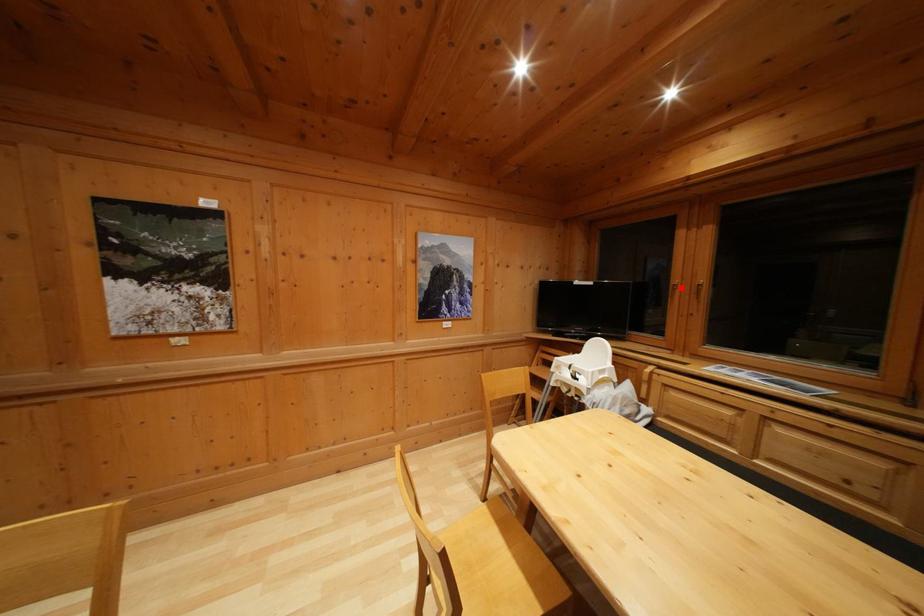
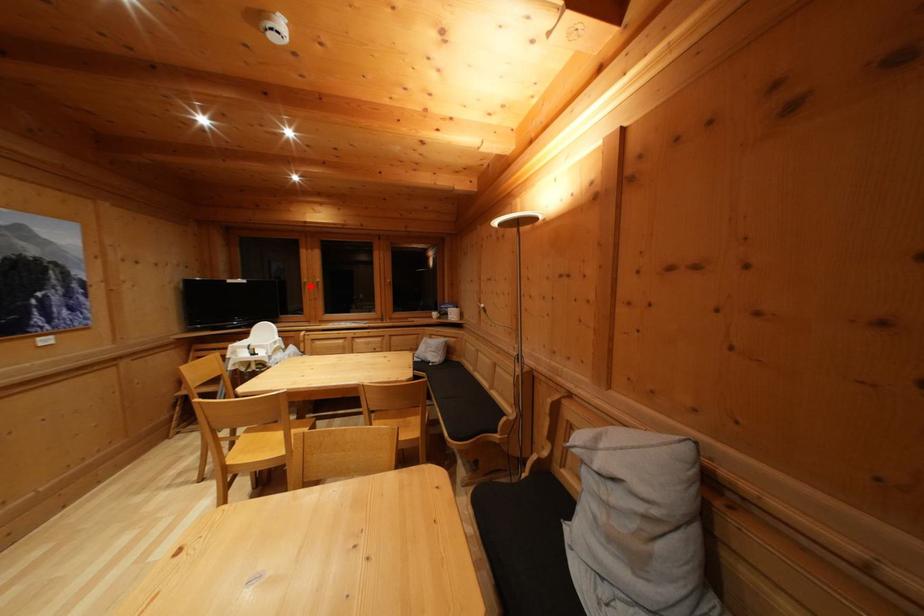
I am providing you with two images of the same scene from different viewpoints. A red point is marked on the first image and another point is marked on the second image. Is the red point in image1 aligned with the point shown in image2?

Yes